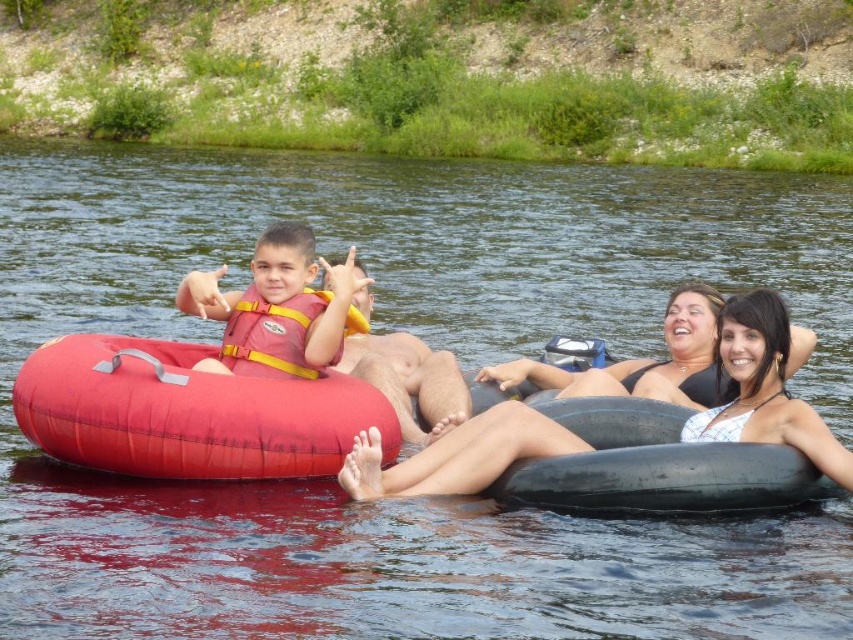
Who is positioned more to the left, white bikini top at center or orange/yellow life jacket at left?

From the viewer's perspective, orange/yellow life jacket at left appears more on the left side.

Who is more forward, (790,420) or (263,336)?

Point (790,420) is more forward.

Where is `white bikini top at center`? The width and height of the screenshot is (853, 640). white bikini top at center is located at coordinates (764, 388).

Describe the element at coordinates (276, 308) in the screenshot. I see `matte pink life vest at left` at that location.

Does point (276, 234) come farther from viewer compared to point (239, 369)?

Yes, it is.

Is point (317, 356) farther from camera compared to point (270, 376)?

No, it is in front of (270, 376).

Find the location of a particular element. The image size is (853, 640). matte pink life vest at left is located at coordinates (276, 308).

Which is more to the left, rubber red tube at left or orange/yellow life jacket at left?

rubber red tube at left

Who is taller, rubber red tube at left or orange/yellow life jacket at left?

rubber red tube at left is taller.

Who is more distant from viewer, (25, 426) or (253, 358)?

The point (253, 358) is behind.

Locate an element on the screen. This screenshot has height=640, width=853. rubber red tube at left is located at coordinates (189, 412).